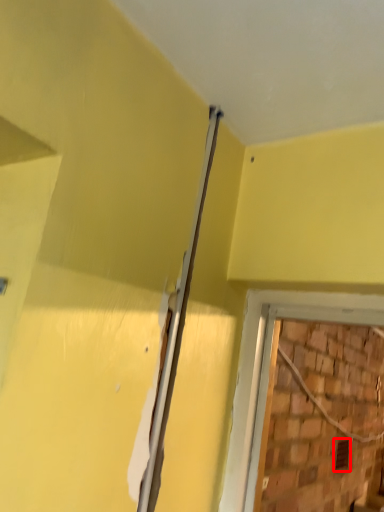
Question: From the image, what is the correct spatial relationship of hole (annotated by the red box) in relation to beam?

Choices:
 (A) right
 (B) left

Answer: (A)